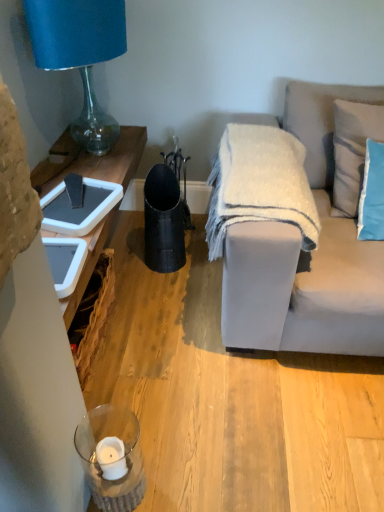
Question: From a real-world perspective, is light gray fabric couch at right beneath blue glass lamp at upper left?

Choices:
 (A) no
 (B) yes

Answer: (B)

Question: Is blue glass lamp at upper left surrounded by light gray fabric couch at right?

Choices:
 (A) no
 (B) yes

Answer: (A)

Question: Is light gray fabric couch at right wider than blue glass lamp at upper left?

Choices:
 (A) yes
 (B) no

Answer: (A)

Question: Considering the relative sizes of light gray fabric couch at right and blue glass lamp at upper left in the image provided, is light gray fabric couch at right bigger than blue glass lamp at upper left?

Choices:
 (A) yes
 (B) no

Answer: (A)

Question: From the image's perspective, does light gray fabric couch at right appear higher than blue glass lamp at upper left?

Choices:
 (A) yes
 (B) no

Answer: (B)

Question: Are light gray fabric couch at right and blue glass lamp at upper left far apart?

Choices:
 (A) yes
 (B) no

Answer: (A)

Question: Does blue fabric pillow at upper right, the 1th pillow positioned from the bottom, have a larger size compared to white fuzzy blanket at center?

Choices:
 (A) yes
 (B) no

Answer: (B)

Question: From the image's perspective, is blue fabric pillow at upper right, marked as the second pillow in a top-to-bottom arrangement, located beneath white fuzzy blanket at center?

Choices:
 (A) no
 (B) yes

Answer: (A)

Question: Considering the relative positions of blue fabric pillow at upper right, the 1th pillow positioned from the bottom, and white fuzzy blanket at center in the image provided, is blue fabric pillow at upper right, the 1th pillow positioned from the bottom, to the right of white fuzzy blanket at center from the viewer's perspective?

Choices:
 (A) yes
 (B) no

Answer: (A)

Question: Is blue fabric pillow at upper right, the 1th pillow positioned from the bottom, closer to the viewer compared to white fuzzy blanket at center?

Choices:
 (A) yes
 (B) no

Answer: (B)

Question: Is blue fabric pillow at upper right, the 1th pillow positioned from the bottom, positioned behind white fuzzy blanket at center?

Choices:
 (A) no
 (B) yes

Answer: (B)

Question: From a real-world perspective, is blue fabric pillow at upper right, marked as the second pillow in a top-to-bottom arrangement, on white fuzzy blanket at center?

Choices:
 (A) yes
 (B) no

Answer: (A)

Question: Would you consider blue glass lamp at upper left to be distant from white fuzzy blanket at center?

Choices:
 (A) no
 (B) yes

Answer: (A)